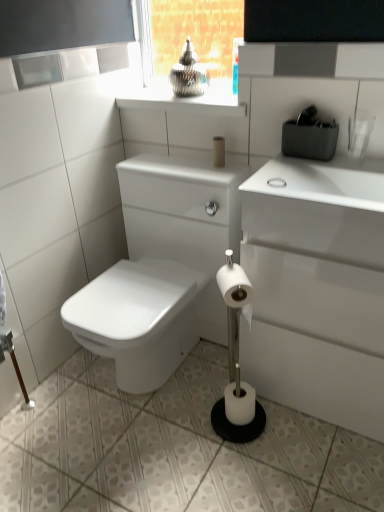
Identify the location of white matte toilet paper at center, which is the second toilet paper in front-to-back order. The height and width of the screenshot is (512, 384). (240, 403).

The image size is (384, 512). What do you see at coordinates (218, 152) in the screenshot?
I see `matte beige toilet paper at center, positioned as the first toilet paper in top-to-bottom order` at bounding box center [218, 152].

Describe the element at coordinates (161, 270) in the screenshot. The height and width of the screenshot is (512, 384). I see `white glossy toilet at lower left` at that location.

Locate an element on the screen. The width and height of the screenshot is (384, 512). white glossy toilet at lower left is located at coordinates (161, 270).

What do you see at coordinates (236, 288) in the screenshot? The image size is (384, 512). I see `white matte toilet paper at center, the 3th toilet paper in the back-to-front sequence` at bounding box center [236, 288].

You are a GUI agent. You are given a task and a screenshot of the screen. Output one action in this format:
    pyautogui.click(x=<x>, y=<y>)
    Task: Click on the white glossy ceramic tile at lower center
    This screenshot has width=384, height=512.
    Given the screenshot: What is the action you would take?
    pyautogui.click(x=174, y=449)

Could you tell me if matte beige toilet paper at center, positioned as the first toilet paper in top-to-bottom order, is facing white glossy toilet at lower left?

No, matte beige toilet paper at center, positioned as the first toilet paper in top-to-bottom order, does not turn towards white glossy toilet at lower left.

Between matte beige toilet paper at center, the third toilet paper in the bottom-to-top sequence, and white glossy toilet at lower left, which one appears on the right side from the viewer's perspective?

matte beige toilet paper at center, the third toilet paper in the bottom-to-top sequence, is more to the right.

Is point (219, 136) positioned behind point (166, 291)?

That is True.

From the image's perspective, is matte beige toilet paper at center, the first toilet paper in the back-to-front sequence, on white glossy toilet at lower left?

Indeed, from the image's perspective, matte beige toilet paper at center, the first toilet paper in the back-to-front sequence, is shown above white glossy toilet at lower left.

Between matte beige toilet paper at center, the third toilet paper in the bottom-to-top sequence, and white matte toilet paper at center, the 1th toilet paper when ordered from bottom to top, which one has more height?

With more height is white matte toilet paper at center, the 1th toilet paper when ordered from bottom to top.

Which object is positioned more to the left, matte beige toilet paper at center, positioned as the first toilet paper in top-to-bottom order, or white matte toilet paper at center, the 2th toilet paper viewed from the back?

matte beige toilet paper at center, positioned as the first toilet paper in top-to-bottom order.

From a real-world perspective, which object stands above the other?

In real-world perspective, matte beige toilet paper at center, positioned as the first toilet paper in top-to-bottom order, is above.

From the picture: Is matte beige toilet paper at center, the third toilet paper in the bottom-to-top sequence, facing away from white matte toilet paper at center, acting as the 3th toilet paper starting from the top?

matte beige toilet paper at center, the third toilet paper in the bottom-to-top sequence, does not have its back to white matte toilet paper at center, acting as the 3th toilet paper starting from the top.

From the image's perspective, is white glossy ceramic tile at lower center above matte beige toilet paper at center, the third toilet paper in the bottom-to-top sequence?

No, from the image's perspective, white glossy ceramic tile at lower center is not above matte beige toilet paper at center, the third toilet paper in the bottom-to-top sequence.

Based on the photo, considering the sizes of objects white glossy ceramic tile at lower center and matte beige toilet paper at center, the first toilet paper in the back-to-front sequence, in the image provided, who is taller, white glossy ceramic tile at lower center or matte beige toilet paper at center, the first toilet paper in the back-to-front sequence,?

Standing taller between the two is matte beige toilet paper at center, the first toilet paper in the back-to-front sequence.

Is white glossy ceramic tile at lower center to the left of matte beige toilet paper at center, which ranks as the third toilet paper in front-to-back order, from the viewer's perspective?

Yes, white glossy ceramic tile at lower center is to the left of matte beige toilet paper at center, which ranks as the third toilet paper in front-to-back order.

From the image's perspective, which one is positioned higher, metallic silver at upper center or white glossy ceramic tile at lower center?

metallic silver at upper center is shown above in the image.

Measure the distance from metallic silver at upper center to white glossy ceramic tile at lower center.

metallic silver at upper center is 4.02 feet away from white glossy ceramic tile at lower center.

Is metallic silver at upper center behind white glossy ceramic tile at lower center?

Yes, metallic silver at upper center is further from the camera.

From a real-world perspective, which object stands above the other?

metallic silver at upper center, from a real-world perspective.

Is there a large distance between white glossy toilet at lower left and white matte toilet paper at center, acting as the 3th toilet paper starting from the top?

No.

Considering their positions, is white glossy toilet at lower left located in front of or behind white matte toilet paper at center, the 1th toilet paper when ordered from bottom to top?

Clearly, white glossy toilet at lower left is in front of white matte toilet paper at center, the 1th toilet paper when ordered from bottom to top.

Is point (218, 192) closer or farther from the camera than point (242, 422)?

Point (218, 192).

Could white matte toilet paper at center, acting as the 3th toilet paper starting from the top, be considered to be inside white glossy toilet at lower left?

Actually, white matte toilet paper at center, acting as the 3th toilet paper starting from the top, is outside white glossy toilet at lower left.

From the image's perspective, is white matte toilet paper at center, the 2th toilet paper from the bottom, above or below metallic silver at upper center?

Based on their image positions, white matte toilet paper at center, the 2th toilet paper from the bottom, is located beneath metallic silver at upper center.

Is white matte toilet paper at center, the 3th toilet paper in the back-to-front sequence, at the right side of metallic silver at upper center?

Correct, you'll find white matte toilet paper at center, the 3th toilet paper in the back-to-front sequence, to the right of metallic silver at upper center.

Considering the sizes of objects white matte toilet paper at center, the 3th toilet paper in the back-to-front sequence, and metallic silver at upper center in the image provided, who is thinner, white matte toilet paper at center, the 3th toilet paper in the back-to-front sequence, or metallic silver at upper center?

With smaller width is white matte toilet paper at center, the 3th toilet paper in the back-to-front sequence.

Does white matte toilet paper at center, the 2th toilet paper from the bottom, have a lesser height compared to metallic silver at upper center?

No.

Which is farther, (x=220, y=288) or (x=74, y=423)?

Positioned behind is point (x=74, y=423).

From the image's perspective, which one is positioned lower, white matte toilet paper at center, the 3th toilet paper in the back-to-front sequence, or white glossy ceramic tile at lower center?

white glossy ceramic tile at lower center.

From a real-world perspective, does white matte toilet paper at center, positioned as the 2th toilet paper in top-to-bottom order, sit lower than white glossy ceramic tile at lower center?

No.

Choose the correct answer: Is white matte toilet paper at center, acting as the 1th toilet paper starting from the front, inside white glossy ceramic tile at lower center or outside it?

white matte toilet paper at center, acting as the 1th toilet paper starting from the front, is outside white glossy ceramic tile at lower center.

This screenshot has width=384, height=512. Identify the location of the 3rd toilet paper behind the white glossy toilet at lower left, counting from the anchor's position. (218, 152).

Identify the location of the 2nd toilet paper below the matte beige toilet paper at center, the third toilet paper in the bottom-to-top sequence (from the image's perspective). The width and height of the screenshot is (384, 512). (240, 403).

Which object lies nearer to the anchor point white glossy toilet at lower left, metallic silver at upper center or matte beige toilet paper at center, the first toilet paper in the back-to-front sequence?

matte beige toilet paper at center, the first toilet paper in the back-to-front sequence.

Considering their positions, is white matte toilet paper at center, acting as the 1th toilet paper starting from the front, positioned closer to metallic silver at upper center than white glossy toilet at lower left?

Among the two, white glossy toilet at lower left is located nearer to metallic silver at upper center.

Based on their spatial positions, is white matte toilet paper at center, acting as the 1th toilet paper starting from the front, or matte beige toilet paper at center, the third toilet paper in the bottom-to-top sequence, closer to white matte toilet paper at center, the 1th toilet paper when ordered from bottom to top?

white matte toilet paper at center, acting as the 1th toilet paper starting from the front.

Based on their spatial positions, is white glossy toilet at lower left or matte beige toilet paper at center, positioned as the first toilet paper in top-to-bottom order, closer to metallic silver at upper center?

matte beige toilet paper at center, positioned as the first toilet paper in top-to-bottom order.

From the image, which object appears to be nearer to matte beige toilet paper at center, the third toilet paper in the bottom-to-top sequence, metallic silver at upper center or white glossy ceramic tile at lower center?

metallic silver at upper center is closer to matte beige toilet paper at center, the third toilet paper in the bottom-to-top sequence.

When comparing their distances from white matte toilet paper at center, the 2th toilet paper from the bottom, does metallic silver at upper center or matte beige toilet paper at center, the first toilet paper in the back-to-front sequence, seem closer?

Based on the image, matte beige toilet paper at center, the first toilet paper in the back-to-front sequence, appears to be nearer to white matte toilet paper at center, the 2th toilet paper from the bottom.

Which object lies nearer to the anchor point white glossy ceramic tile at lower center, metallic silver at upper center or matte beige toilet paper at center, positioned as the first toilet paper in top-to-bottom order?

matte beige toilet paper at center, positioned as the first toilet paper in top-to-bottom order, is closer to white glossy ceramic tile at lower center.

Estimate the real-world distances between objects in this image. Which object is further from white matte toilet paper at center, acting as the 1th toilet paper starting from the front, matte beige toilet paper at center, which ranks as the third toilet paper in front-to-back order, or white matte toilet paper at center, which is the second toilet paper in front-to-back order?

matte beige toilet paper at center, which ranks as the third toilet paper in front-to-back order, is positioned further to the anchor white matte toilet paper at center, acting as the 1th toilet paper starting from the front.

Locate an element on the screen. Image resolution: width=384 pixels, height=512 pixels. porcelain between white glossy ceramic tile at lower center and white matte toilet paper at center, the 1th toilet paper when ordered from bottom to top, from front to back is located at coordinates (161, 270).

Locate an element on the screen. The image size is (384, 512). porcelain between matte beige toilet paper at center, the third toilet paper in the bottom-to-top sequence, and white matte toilet paper at center, which is the second toilet paper in front-to-back order, in the up-down direction is located at coordinates (161, 270).

The width and height of the screenshot is (384, 512). What are the coordinates of `porcelain between matte beige toilet paper at center, the third toilet paper in the bottom-to-top sequence, and white matte toilet paper at center, the 2th toilet paper from the bottom, in the vertical direction` in the screenshot? It's located at (161, 270).

The height and width of the screenshot is (512, 384). Identify the location of porcelain between metallic silver at upper center and white matte toilet paper at center, which is the second toilet paper in front-to-back order, vertically. (161, 270).